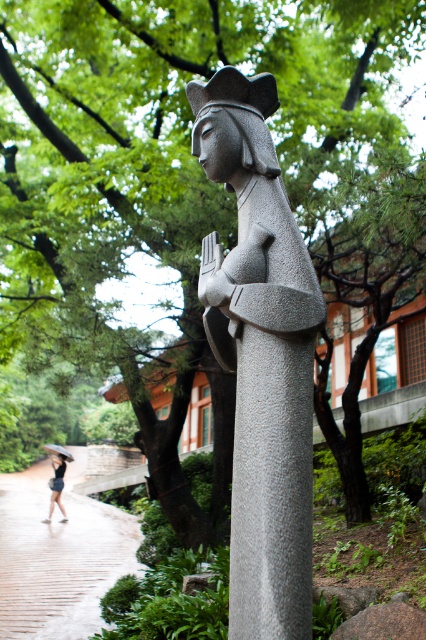
You are a visitor in the park and want to walk towards the statue. You see the brown brick path at lower left and the matte black dress at lower left. Which one is closer to you?

The brown brick path at lower left is closer to you since it has a smaller size compared to the matte black dress at lower left, indicating it is nearer in the scene.

You are an artist planning to sketch the granite statue at center and the matte black dress at lower left. Based on their sizes, which object should you focus on first to ensure proper proportions in your drawing?

The granite statue at center has a smaller size compared to the matte black dress at lower left. Therefore, you should sketch the matte black dress at lower left first to establish the larger scale before adding the smaller granite statue at center.